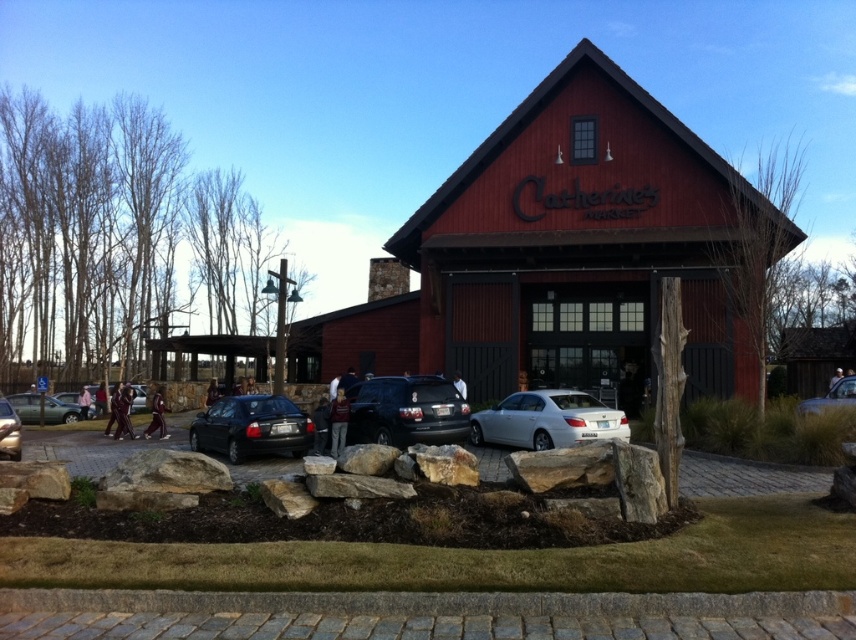
Is metallic silver sedan at center wider than matte black car at lower left?

Yes, metallic silver sedan at center is wider than matte black car at lower left.

Consider the image. How much distance is there between metallic silver sedan at center and matte black car at lower left?

metallic silver sedan at center and matte black car at lower left are 29.14 meters apart from each other.

The image size is (856, 640). I want to click on metallic silver sedan at center, so click(x=831, y=396).

Locate an element on the screen. This screenshot has width=856, height=640. metallic silver sedan at center is located at coordinates (831, 396).

Between shiny black sedan at center and matte black sedan at center, which one is positioned lower?

matte black sedan at center is lower down.

Is point (306, 436) positioned before point (10, 445)?

No, (306, 436) is further to viewer.

Which is behind, point (283, 451) or point (10, 424)?

The point (283, 451) is behind.

Identify the location of shiny black sedan at center. Image resolution: width=856 pixels, height=640 pixels. click(253, 428).

Can you confirm if metallic silver sedan at center is wider than matte black sedan at center?

Indeed, metallic silver sedan at center has a greater width compared to matte black sedan at center.

Is metallic silver sedan at center to the right of matte black sedan at center from the viewer's perspective?

Indeed, metallic silver sedan at center is positioned on the right side of matte black sedan at center.

Find the location of a particular element. The width and height of the screenshot is (856, 640). metallic silver sedan at center is located at coordinates (831, 396).

This screenshot has width=856, height=640. I want to click on metallic silver sedan at center, so click(x=831, y=396).